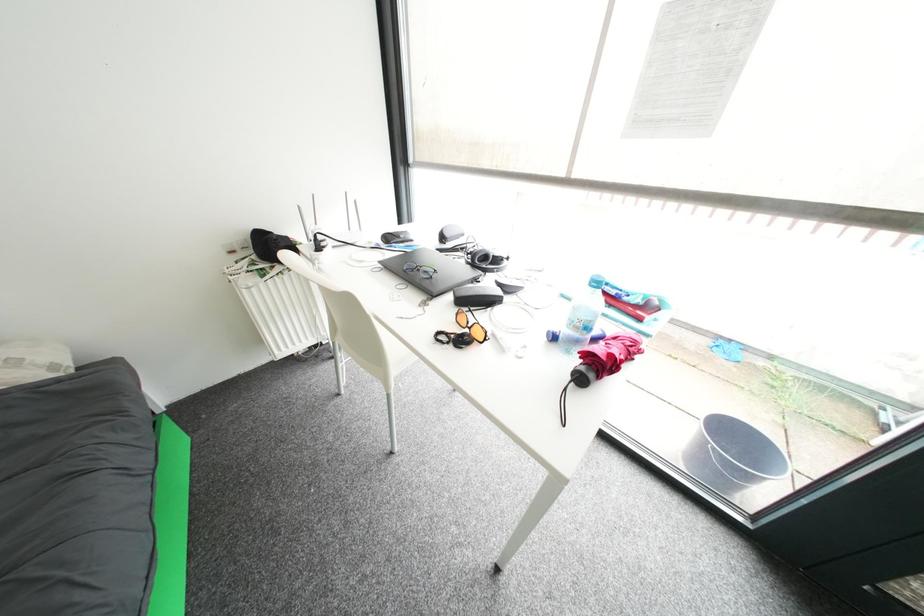
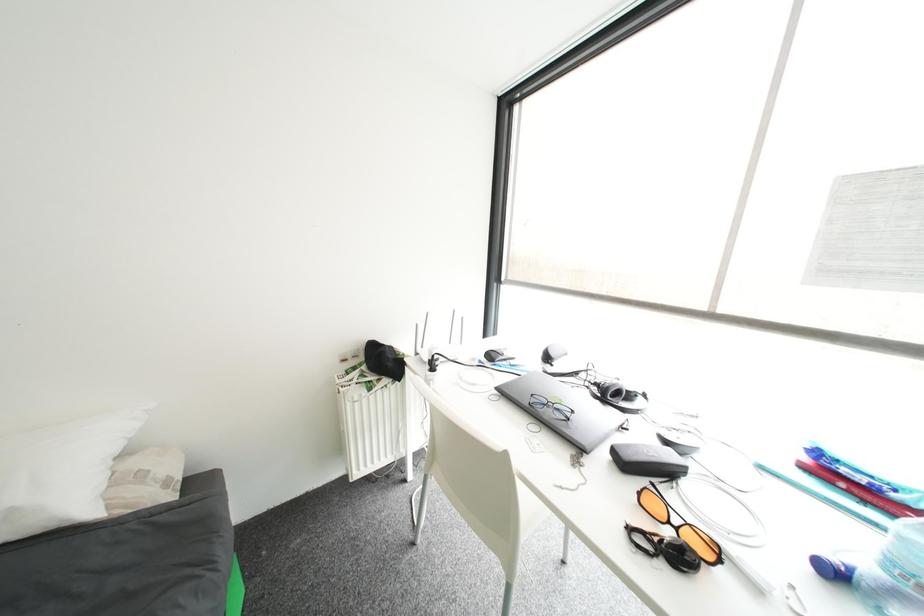
Question: How did the camera likely rotate?

Choices:
 (A) Left
 (B) Right
 (C) Up
 (D) Down

Answer: (C)